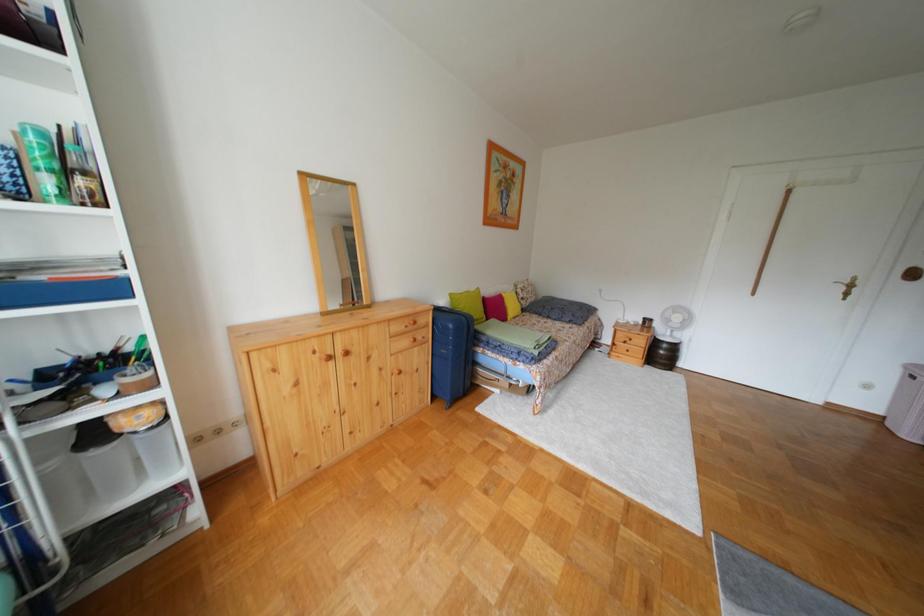
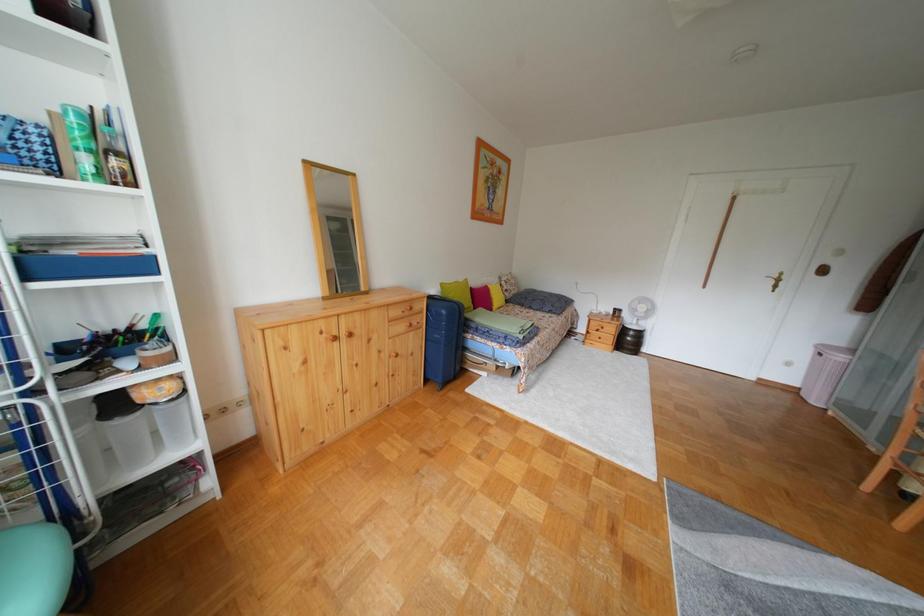
Question: The camera is either moving clockwise (left) or counter-clockwise (right) around the object. The first image is from the beginning of the video and the second image is from the end. Is the camera moving left or right when shooting the video?

Choices:
 (A) Left
 (B) Right

Answer: (A)